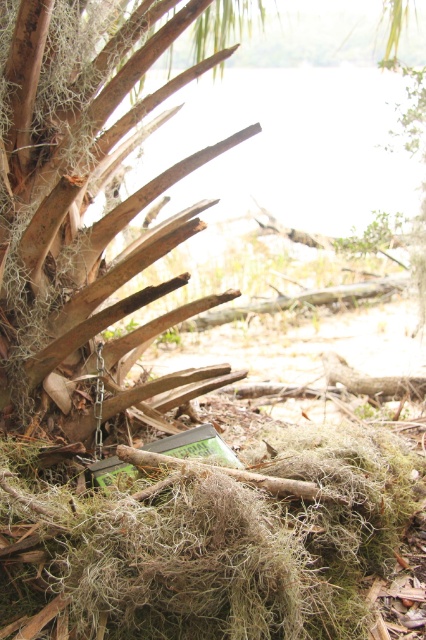
You are a hiker who has just found a green plastic canister at lower center and a transparent water at upper center in the scene. Which object is positioned higher from the ground?

The transparent water at upper center is positioned higher from the ground than the green plastic canister at lower center.

You are a hiker who just found a green plastic canister at lower center and a brown rough palm tree at center in a forest. You need to place the canister on a higher spot. Which object should you use as a base?

The brown rough palm tree at center is higher than the green plastic canister at lower center, so you should place the canister on the brown rough palm tree at center.